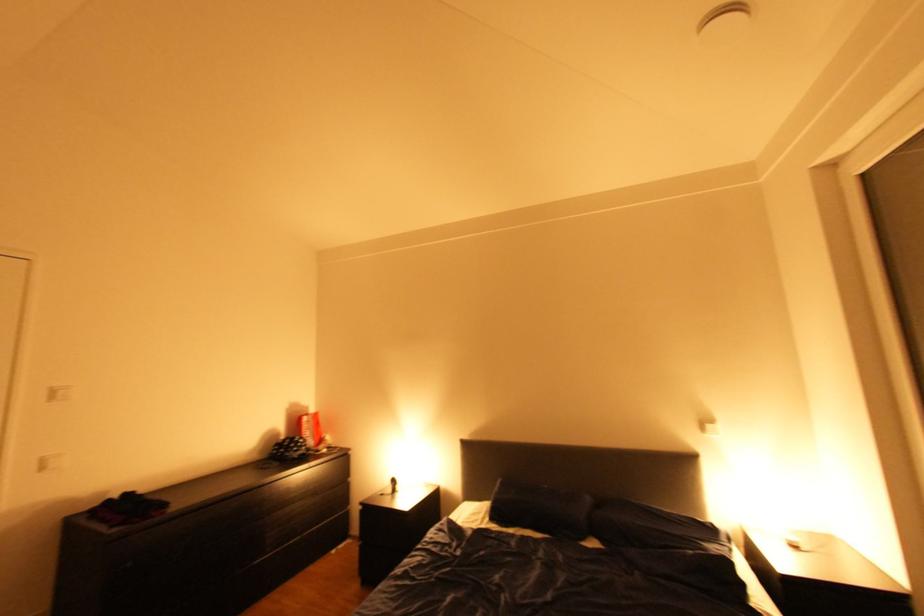
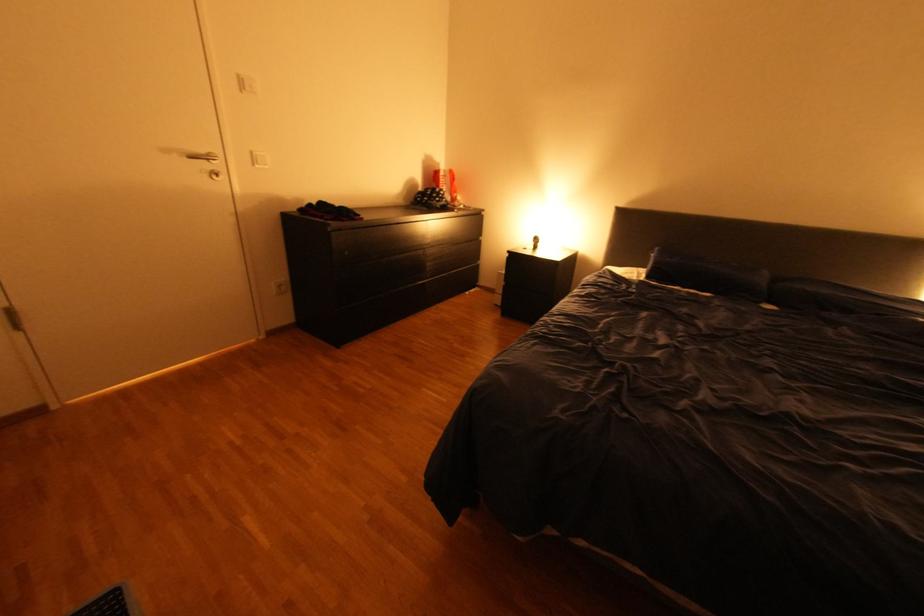
Find the pixel in the second image that matches [52,468] in the first image.

(264, 161)